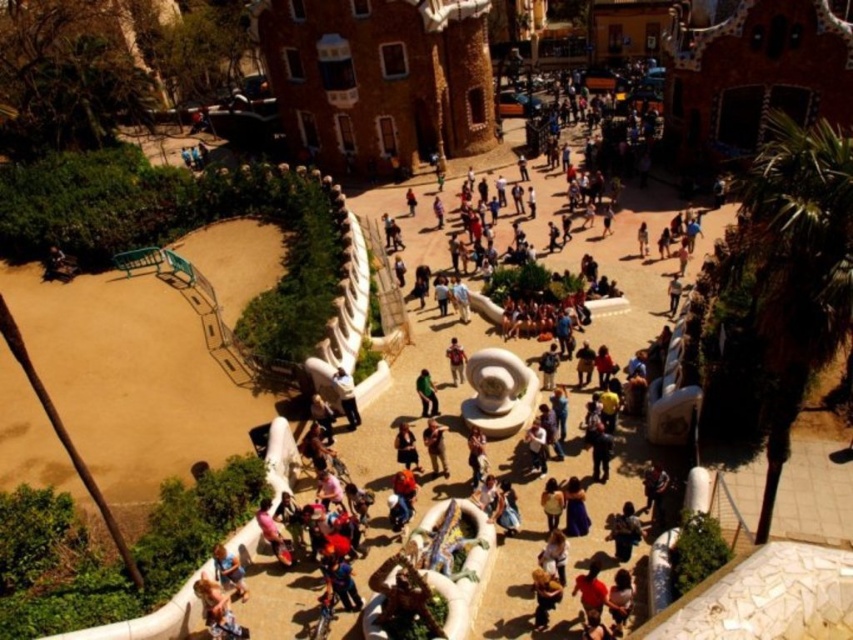
Question: Is green matte pants at center thinner than matte brown backpack at center?

Choices:
 (A) no
 (B) yes

Answer: (A)

Question: Is light blue denim jeans at center to the left of green matte pants at center from the viewer's perspective?

Choices:
 (A) no
 (B) yes

Answer: (B)

Question: From the image, what is the correct spatial relationship of brown leather jacket at center in relation to light blue denim jeans at center?

Choices:
 (A) right
 (B) left

Answer: (A)

Question: Based on their relative distances, which object is nearer to the matte brown backpack at center?

Choices:
 (A) green matte pants at center
 (B) brown leather jacket at center

Answer: (A)

Question: Among these points, which one is farthest from the camera?

Choices:
 (A) (424, 371)
 (B) (338, 380)

Answer: (A)

Question: Which of the following is the farthest from the observer?

Choices:
 (A) matte brown backpack at center
 (B) brown leather jacket at center
 (C) green matte pants at center

Answer: (A)